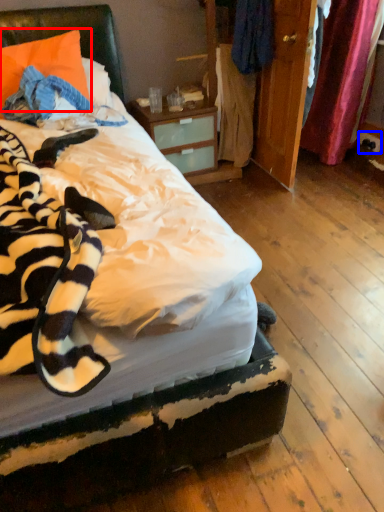
Question: Which object is closer to the camera taking this photo, pillow (highlighted by a red box) or power outlet (highlighted by a blue box)?

Choices:
 (A) pillow
 (B) power outlet

Answer: (A)